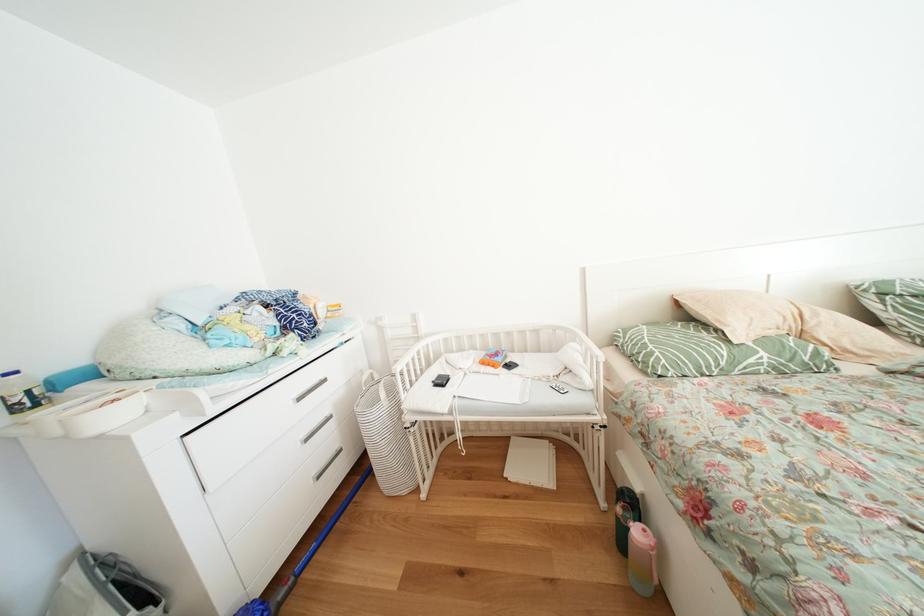
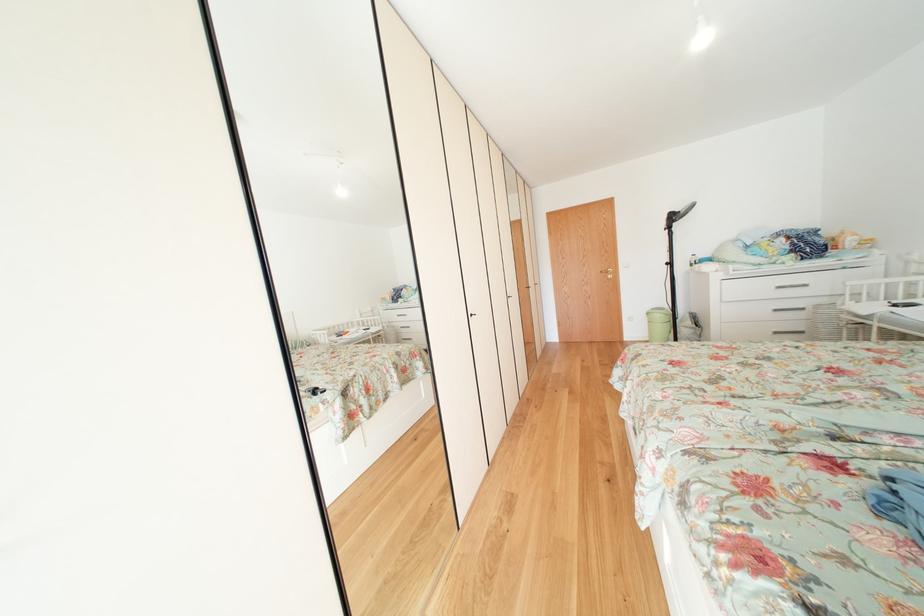
The point at (310,403) is marked in the first image. Where is the corresponding point in the second image?

(787, 292)